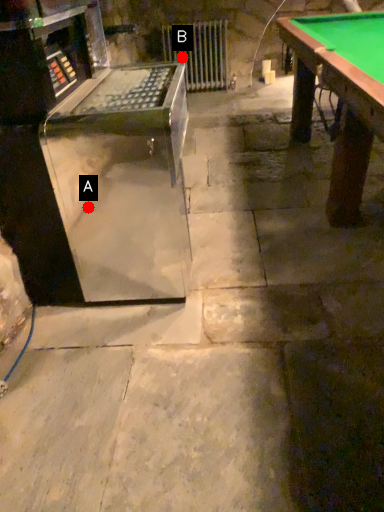
Question: Two points are circled on the image, labeled by A and B beside each circle. Which point is closer to the camera?

Choices:
 (A) A is closer
 (B) B is closer

Answer: (A)